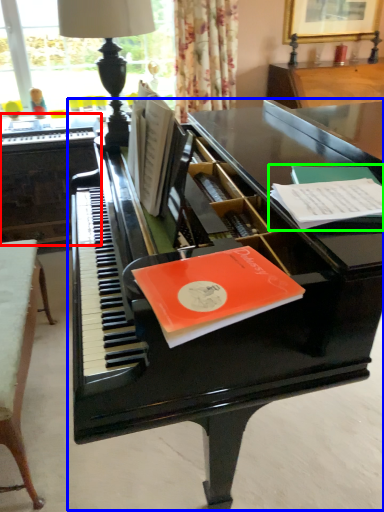
Question: Estimate the real-world distances between objects in this image. Which object is closer to table (highlighted by a red box), piano (highlighted by a blue box) or paperback book (highlighted by a green box)?

Choices:
 (A) piano
 (B) paperback book

Answer: (A)